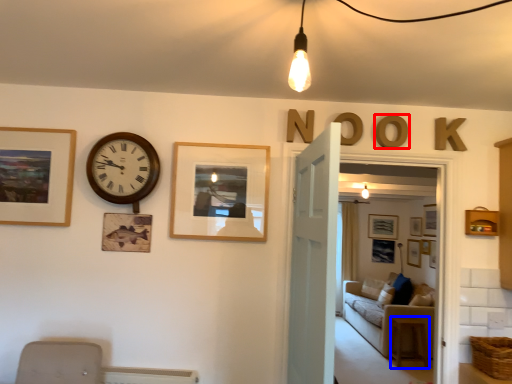
Question: Among these objects, which one is farthest to the camera, letter (highlighted by a red box) or changing table (highlighted by a blue box)?

Choices:
 (A) letter
 (B) changing table

Answer: (B)